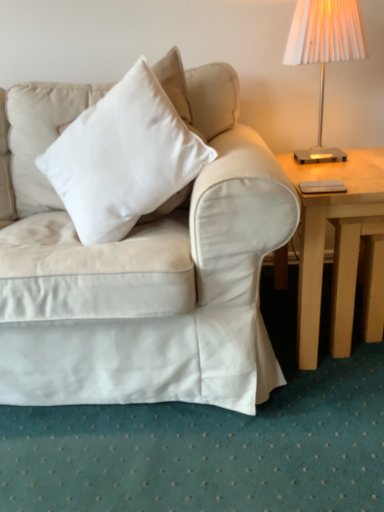
Question: From the image's perspective, is satin white couch at center on top of light wood table at right?

Choices:
 (A) yes
 (B) no

Answer: (A)

Question: Does satin white couch at center lie in front of light wood table at right?

Choices:
 (A) yes
 (B) no

Answer: (A)

Question: Does satin white couch at center have a greater width compared to light wood table at right?

Choices:
 (A) yes
 (B) no

Answer: (B)

Question: Is satin white couch at center oriented towards light wood table at right?

Choices:
 (A) yes
 (B) no

Answer: (B)

Question: Is satin white couch at center behind light wood table at right?

Choices:
 (A) no
 (B) yes

Answer: (A)

Question: From a real-world perspective, is light wood table at right positioned above or below satin white couch at center?

Choices:
 (A) above
 (B) below

Answer: (B)

Question: Relative to satin white couch at center, is light wood table at right in front or behind?

Choices:
 (A) behind
 (B) front

Answer: (A)

Question: Based on their sizes in the image, would you say light wood table at right is bigger or smaller than satin white couch at center?

Choices:
 (A) small
 (B) big

Answer: (A)

Question: Is point (304, 330) closer or farther from the camera than point (254, 269)?

Choices:
 (A) farther
 (B) closer

Answer: (A)

Question: Is white soft cushion at upper left inside the boundaries of metallic silver lampshade at upper right, or outside?

Choices:
 (A) outside
 (B) inside

Answer: (A)

Question: From a real-world perspective, is white soft cushion at upper left physically located above or below metallic silver lampshade at upper right?

Choices:
 (A) above
 (B) below

Answer: (B)

Question: Considering the positions of white soft cushion at upper left and metallic silver lampshade at upper right in the image, is white soft cushion at upper left bigger or smaller than metallic silver lampshade at upper right?

Choices:
 (A) big
 (B) small

Answer: (A)

Question: Considering the positions of white soft cushion at upper left and metallic silver lampshade at upper right in the image, is white soft cushion at upper left taller or shorter than metallic silver lampshade at upper right?

Choices:
 (A) tall
 (B) short

Answer: (A)

Question: From their relative heights in the image, would you say white soft cushion at upper left is taller or shorter than light wood table at right?

Choices:
 (A) tall
 (B) short

Answer: (A)

Question: Considering the positions of white soft cushion at upper left and light wood table at right in the image, is white soft cushion at upper left wider or thinner than light wood table at right?

Choices:
 (A) wide
 (B) thin

Answer: (B)